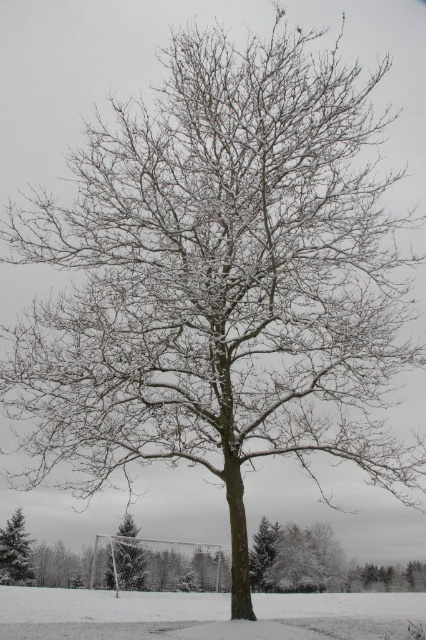
Is snowy grass at center further to camera compared to white frosty tree at lower center?

That is True.

Is point (282, 605) closer to camera compared to point (118, 547)?

That is False.

Identify the location of snowy grass at center. Image resolution: width=426 pixels, height=640 pixels. (106, 605).

Who is positioned more to the left, snowy grass at center or green matte evergreen tree at lower left?

green matte evergreen tree at lower left

This screenshot has height=640, width=426. Describe the element at coordinates (106, 605) in the screenshot. I see `snowy grass at center` at that location.

This screenshot has width=426, height=640. Describe the element at coordinates (106, 605) in the screenshot. I see `snowy grass at center` at that location.

This screenshot has width=426, height=640. In order to click on snowy grass at center in this screenshot , I will do pyautogui.click(x=106, y=605).

Does point (129, 566) come behind point (22, 550)?

Yes, it is behind point (22, 550).

You are a GUI agent. You are given a task and a screenshot of the screen. Output one action in this format:
    pyautogui.click(x=<x>, y=<y>)
    Task: Click on the white frosty tree at lower center
    The height and width of the screenshot is (640, 426).
    Given the screenshot: What is the action you would take?
    pyautogui.click(x=126, y=557)

I want to click on white frosty tree at lower center, so click(x=126, y=557).